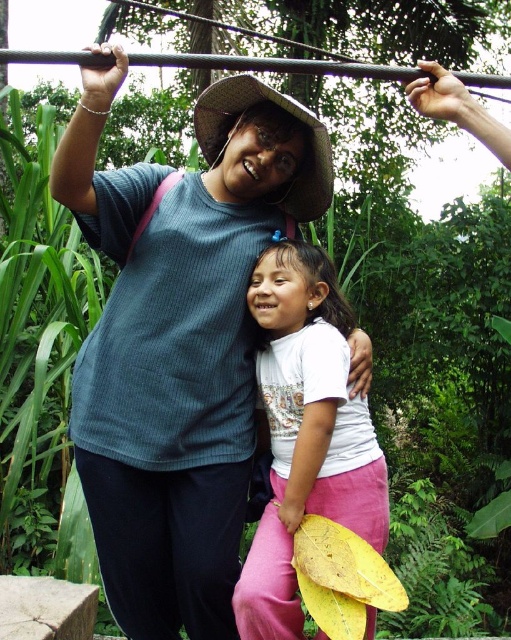
You are standing 5 feet away from the camera. You want to take a photo of the blue ribbed shirt at center. Can you reach it without moving your position?

The blue ribbed shirt at center is 6.96 feet away from the camera. Since you are already 5 feet away from the camera, the total distance between you and the shirt is 1.96 feet. Therefore, you can easily reach it without moving your position.

You are standing in the scene and want to place a small decorative rock at the point closer to you between point (187, 221) and point (280, 340). Which point should you choose?

You should choose point (187, 221) because it is closer to the viewer than point (280, 340).

You are standing at the center of the image and want to locate the blue ribbed shirt at center. According to the coordinates provided, in which direction should you look to find it?

The blue ribbed shirt at center is located at coordinates point (178,340), so you should look slightly to the right and down from the exact center to find it.